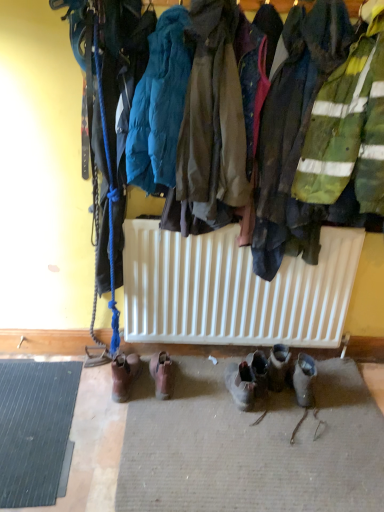
This screenshot has height=512, width=384. In order to click on vacant region above black rubber mat at lower left (from a real-world perspective) in this screenshot , I will do `click(33, 412)`.